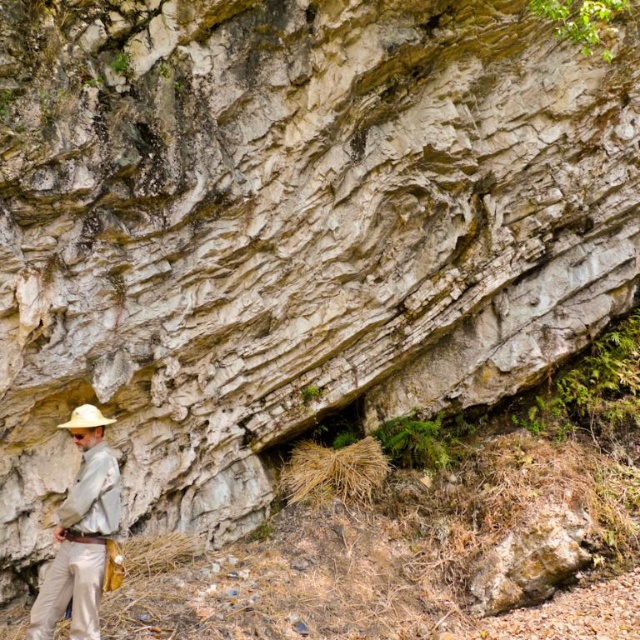
You are a photographer trying to capture the explorer in the scene. You want to focus on the khaki cotton pants at lower left and the white matte cowboy hat at lower left. Which object should you adjust your camera to focus on first if you want to start from the bottom and move upwards?

You should focus on the khaki cotton pants at lower left first because it is located below the white matte cowboy hat at lower left, so starting from the bottom would mean beginning with the khaki cotton pants at lower left.

You are a hiker who wants to place a 3.5 feet long hiking pole between the khaki cotton pants at lower left and the white matte cowboy hat at lower left. Can you fit the pole between them?

The distance between the khaki cotton pants at lower left and the white matte cowboy hat at lower left is 3.49 feet, which is slightly shorter than the 3.5 feet long hiking pole. Therefore, the pole cannot be placed between them without bending or adjusting the position.